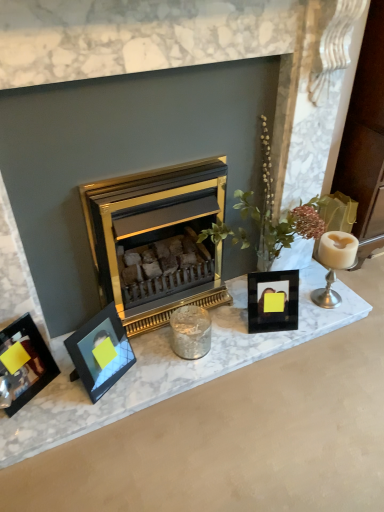
Question: From a real-world perspective, is metallic silver photo frame at left, which is counted as the 3th picture frame, starting from the right, above or below matte black picture frame at left, the second picture frame when ordered from right to left?

Choices:
 (A) below
 (B) above

Answer: (B)

Question: From the image's perspective, is metallic silver photo frame at left, which appears as the 1th picture frame when viewed from the left, located above or below matte black picture frame at left, which is the second picture frame in left-to-right order?

Choices:
 (A) below
 (B) above

Answer: (A)

Question: Which of these objects is positioned farthest from the matte black picture frame at left, the second picture frame when ordered from right to left?

Choices:
 (A) gold metallic wood burning stove at center
 (B) white glossy candle holder at right, which appears as the second candle holder when viewed from the left
 (C) gold metallic fireplace at center
 (D) silver metallic candle holder at center, marked as the first candle holder in a left-to-right arrangement
 (E) black glass photo frame at center, which ranks as the third picture frame in left-to-right order

Answer: (B)

Question: Based on their relative distances, which object is farther from the metallic silver photo frame at left, which is counted as the 3th picture frame, starting from the right?

Choices:
 (A) gold metallic fireplace at center
 (B) silver metallic candle holder at center, the second candle holder positioned from the right
 (C) matte black picture frame at left, which is the second picture frame in left-to-right order
 (D) black glass photo frame at center, which is the first picture frame from right to left
 (E) white glossy candle holder at right, which appears as the second candle holder when viewed from the left

Answer: (E)